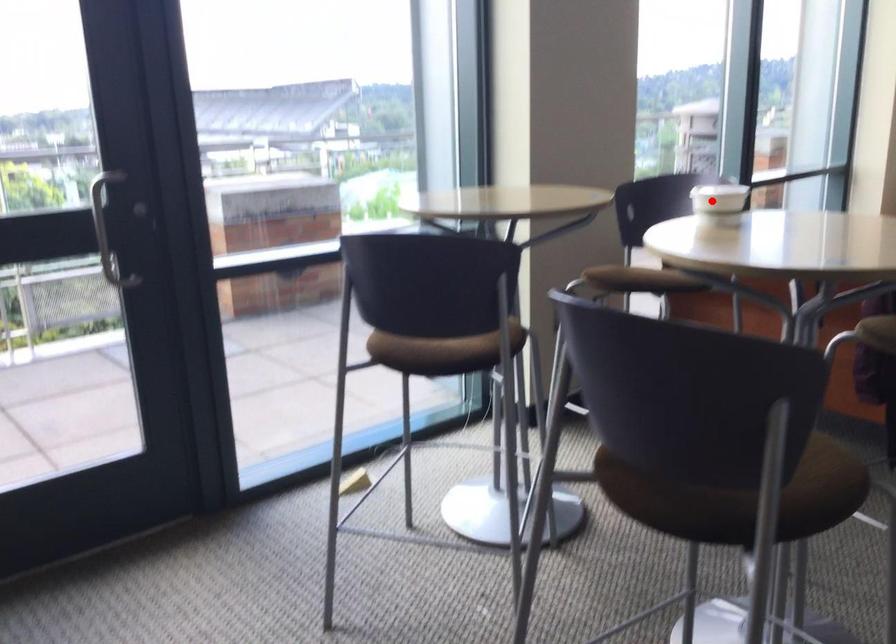
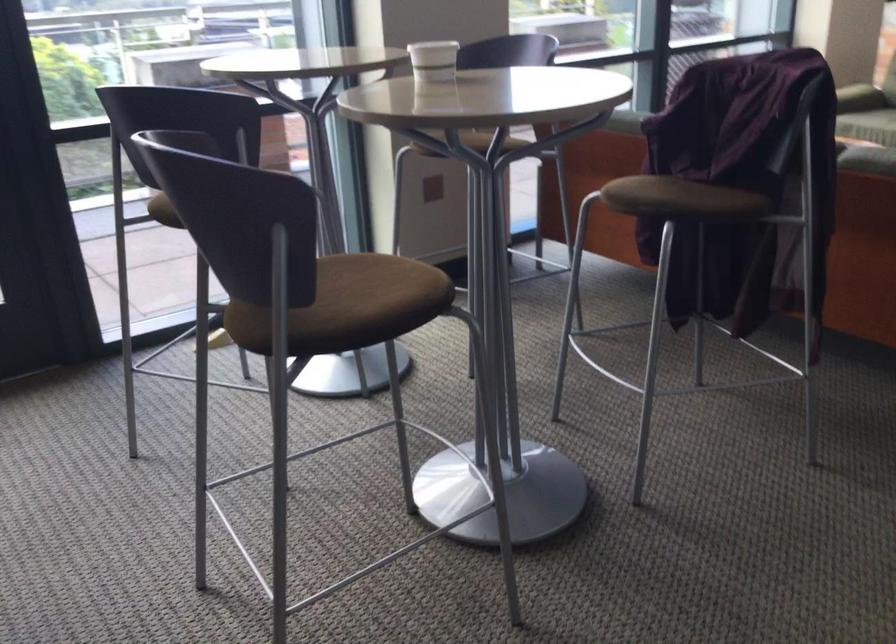
Question: I am providing you with two images of the same scene from different viewpoints. A red point is marked on the first image. At the location where the point appears in image 1, is it still visible in image 2?

Choices:
 (A) Yes
 (B) No

Answer: (A)